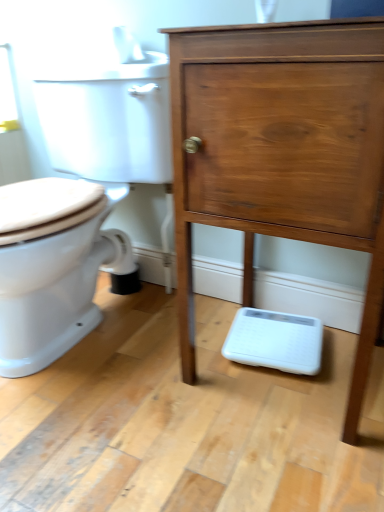
Where is `free spot in front of white glossy toilet at left`? This screenshot has height=512, width=384. free spot in front of white glossy toilet at left is located at coordinates (125, 434).